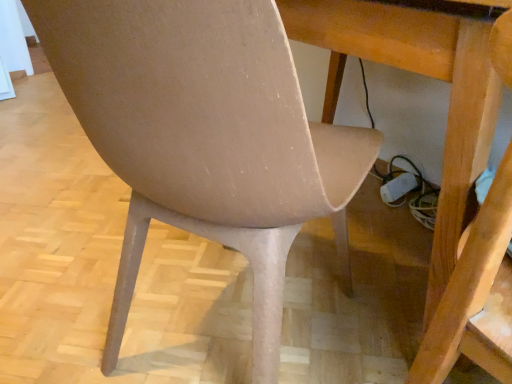
Question: Considering the relative sizes of wooden table at center and matte beige chair at center in the image provided, is wooden table at center thinner than matte beige chair at center?

Choices:
 (A) yes
 (B) no

Answer: (B)

Question: Does wooden table at center appear on the left side of matte beige chair at center?

Choices:
 (A) yes
 (B) no

Answer: (B)

Question: Is wooden table at center shorter than matte beige chair at center?

Choices:
 (A) yes
 (B) no

Answer: (A)

Question: Can you confirm if wooden table at center is positioned to the right of matte beige chair at center?

Choices:
 (A) no
 (B) yes

Answer: (B)

Question: Does wooden table at center have a smaller size compared to matte beige chair at center?

Choices:
 (A) yes
 (B) no

Answer: (B)

Question: Based on their sizes in the image, would you say matte beige swivel chair at lower left is bigger or smaller than matte beige chair at center?

Choices:
 (A) big
 (B) small

Answer: (B)

Question: Considering their positions, is matte beige swivel chair at lower left located in front of or behind matte beige chair at center?

Choices:
 (A) behind
 (B) front

Answer: (B)

Question: In terms of width, does matte beige swivel chair at lower left look wider or thinner when compared to matte beige chair at center?

Choices:
 (A) wide
 (B) thin

Answer: (B)

Question: Based on their positions, is matte beige swivel chair at lower left located to the left or right of matte beige chair at center?

Choices:
 (A) right
 (B) left

Answer: (A)

Question: Relative to matte beige swivel chair at lower left, is wooden table at center in front or behind?

Choices:
 (A) front
 (B) behind

Answer: (B)

Question: Visually, is wooden table at center positioned to the left or to the right of matte beige swivel chair at lower left?

Choices:
 (A) left
 (B) right

Answer: (A)

Question: From the image's perspective, relative to matte beige swivel chair at lower left, is wooden table at center above or below?

Choices:
 (A) above
 (B) below

Answer: (A)

Question: Is wooden table at center spatially inside matte beige swivel chair at lower left, or outside of it?

Choices:
 (A) inside
 (B) outside

Answer: (B)

Question: Based on their positions, is matte beige swivel chair at lower left located to the left or right of wooden table at center?

Choices:
 (A) right
 (B) left

Answer: (A)

Question: Considering their positions, is matte beige swivel chair at lower left located in front of or behind wooden table at center?

Choices:
 (A) behind
 (B) front

Answer: (B)